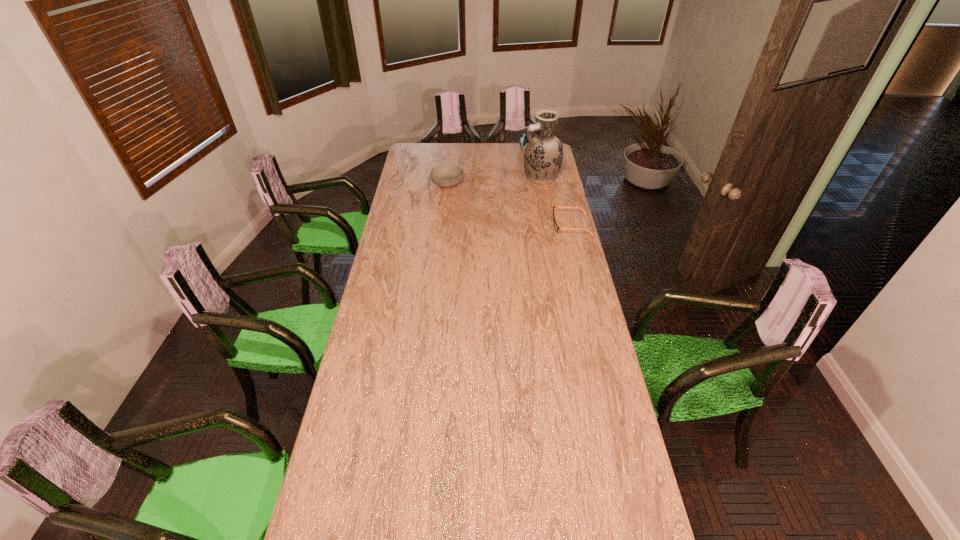
This screenshot has height=540, width=960. Identify the location of free space located on the front-facing side of the spectacles. (535, 225).

What are the coordinates of `free space located with the handle on the side of the vase` in the screenshot? It's located at (469, 207).

Identify the location of vacant area located with the handle on the side of the vase. The image size is (960, 540). (500, 194).

Find the location of a particular element. The width and height of the screenshot is (960, 540). free spot located 0.280m with the handle on the side of the vase is located at coordinates (488, 199).

Locate an element on the screen. The width and height of the screenshot is (960, 540). free space located on the ear cups of the farthest object is located at coordinates (518, 171).

Where is `blank space located 0.290m on the ear cups of the farthest object`? Image resolution: width=960 pixels, height=540 pixels. blank space located 0.290m on the ear cups of the farthest object is located at coordinates (516, 175).

You are a GUI agent. You are given a task and a screenshot of the screen. Output one action in this format:
    pyautogui.click(x=<x>, y=<y>)
    Task: Click on the vacant position located 0.220m on the ear cups of the farthest object
    The image size is (960, 540).
    Given the screenshot: What is the action you would take?
    pyautogui.click(x=519, y=169)

Locate an element on the screen. The width and height of the screenshot is (960, 540). object that is positioned at the far edge is located at coordinates (522, 138).

Find the location of `spectacles that is at the right edge`. spectacles that is at the right edge is located at coordinates (556, 227).

Identify the location of vase that is at the right edge. The width and height of the screenshot is (960, 540). [x=543, y=155].